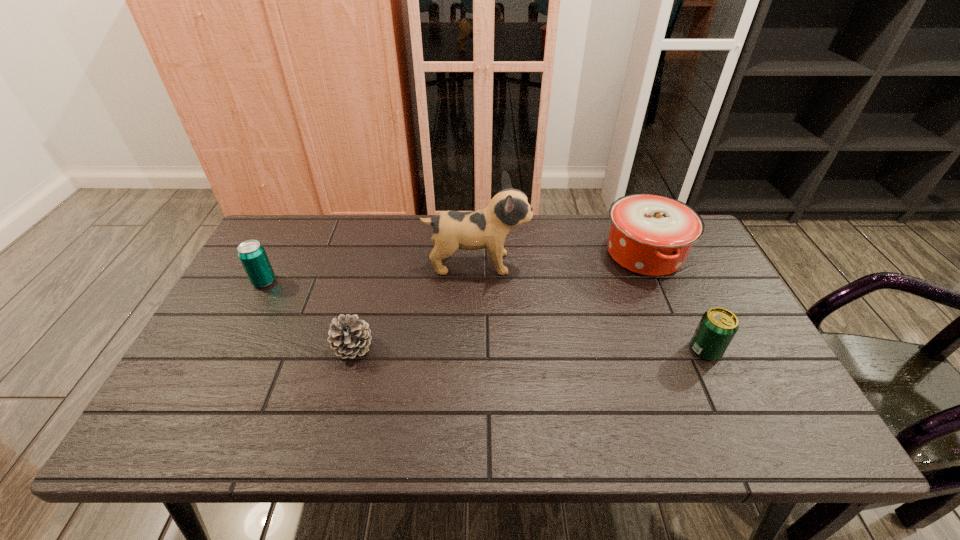
Find the location of a particular element. The height and width of the screenshot is (540, 960). puppy is located at coordinates (488, 228).

At what (x,y) coordinates should I click in order to perform the action: click on the third object from right to left. Please return your answer as a coordinate pair (x, y). Looking at the image, I should click on (488, 228).

Find the location of a particular element. the second tallest object is located at coordinates (650, 234).

Locate an element on the screen. the left beer can is located at coordinates (251, 253).

Where is `the farther beer can`? The height and width of the screenshot is (540, 960). the farther beer can is located at coordinates (251, 253).

Where is `the nearer beer can`? Image resolution: width=960 pixels, height=540 pixels. the nearer beer can is located at coordinates (718, 326).

Locate an element on the screen. the fourth object from right to left is located at coordinates (349, 336).

Identify the location of blank space located at the face of the tallest object. The height and width of the screenshot is (540, 960). (601, 264).

Locate an element on the screen. free region located 0.050m on the right of the casserole is located at coordinates (704, 254).

Find the location of a particular element. vacant space located 0.220m on the front of the left beer can is located at coordinates (228, 352).